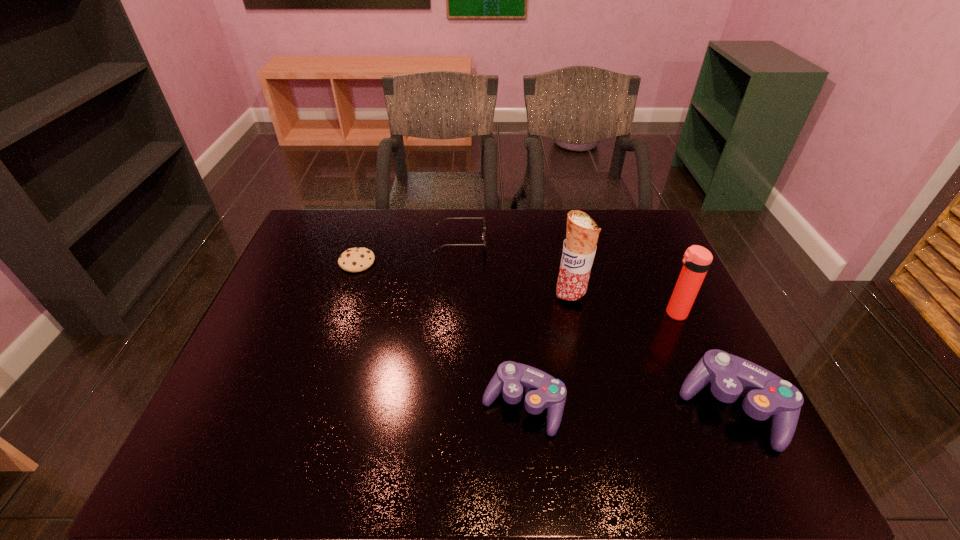
Please show where to add a control on the left while keeping spacing even. Please provide its 2D coordinates. Your answer should be formatted as a tuple, i.e. [(x, y)], where the tuple contains the x and y coordinates of a point satisfying the conditions above.

[(316, 402)]